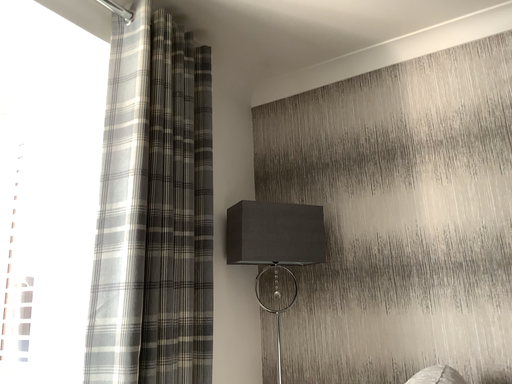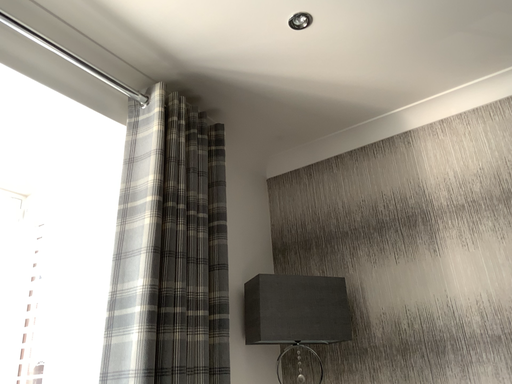
Question: How did the camera likely rotate when shooting the video?

Choices:
 (A) rotated upward
 (B) rotated downward

Answer: (A)